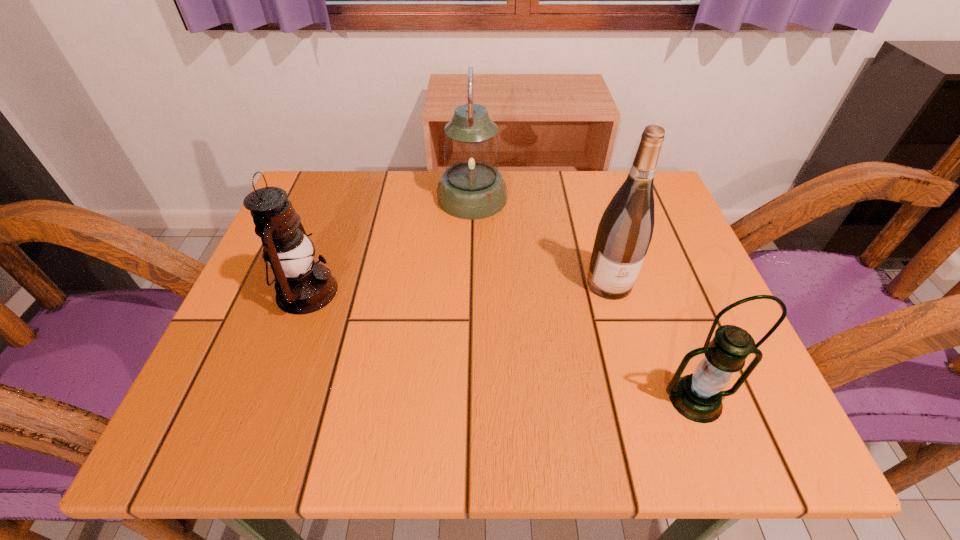
Image resolution: width=960 pixels, height=540 pixels. I want to click on vacant space at the far left corner of the desktop, so click(332, 199).

Find the location of a particular element. The image size is (960, 540). empty space that is in between the wine bottle and the second lantern from left to right is located at coordinates (540, 241).

Where is `free space between the leftmost lantern and the rightmost lantern`? The image size is (960, 540). free space between the leftmost lantern and the rightmost lantern is located at coordinates (501, 345).

At what (x,y) coordinates should I click in order to perform the action: click on blank region between the farthest object and the rightmost lantern. Please return your answer as a coordinate pair (x, y). The height and width of the screenshot is (540, 960). Looking at the image, I should click on (584, 299).

Locate an element on the screen. The height and width of the screenshot is (540, 960). empty location between the second object from left to right and the wine bottle is located at coordinates (540, 241).

Locate an element on the screen. vacant space that's between the rightmost lantern and the wine bottle is located at coordinates (653, 341).

You are a GUI agent. You are given a task and a screenshot of the screen. Output one action in this format:
    pyautogui.click(x=<x>, y=<y>)
    Task: Click on the vacant area between the nearest object and the wine bottle
    
    Given the screenshot: What is the action you would take?
    pyautogui.click(x=653, y=341)

You are a GUI agent. You are given a task and a screenshot of the screen. Output one action in this format:
    pyautogui.click(x=<x>, y=<y>)
    Task: Click on the vacant area that lies between the farthest lantern and the nearest lantern
    Image resolution: width=960 pixels, height=540 pixels.
    Given the screenshot: What is the action you would take?
    pyautogui.click(x=584, y=299)

This screenshot has height=540, width=960. In order to click on free space between the nearest object and the wine bottle in this screenshot , I will do `click(653, 341)`.

Where is `free spot between the leftmost lantern and the rightmost lantern`? The width and height of the screenshot is (960, 540). free spot between the leftmost lantern and the rightmost lantern is located at coordinates (501, 345).